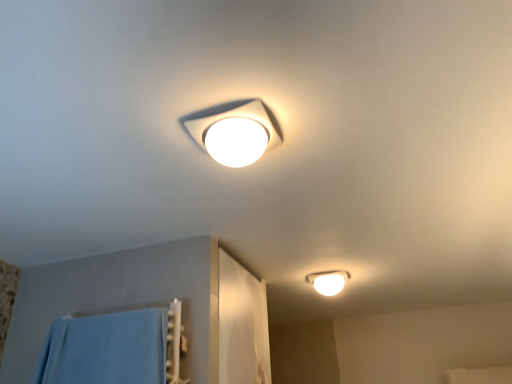
Question: Relative to white glossy light fixture at lower right, which is counted as the first lamp, starting from the right, is white matte lamp at upper center, which appears as the first lamp when viewed from the front, in front or behind?

Choices:
 (A) front
 (B) behind

Answer: (A)

Question: From the image's perspective, is white matte lamp at upper center, which appears as the first lamp when viewed from the front, located above or below white glossy light fixture at lower right, which is counted as the second lamp, starting from the left?

Choices:
 (A) above
 (B) below

Answer: (A)

Question: Looking at the image, does white matte lamp at upper center, which appears as the first lamp when viewed from the front, seem bigger or smaller compared to white glossy light fixture at lower right, which is counted as the second lamp, starting from the left?

Choices:
 (A) small
 (B) big

Answer: (A)

Question: Is white glossy light fixture at lower right, placed as the second lamp when sorted from top to bottom, wider or thinner than white matte lamp at upper center, which appears as the first lamp when viewed from the front?

Choices:
 (A) thin
 (B) wide

Answer: (B)

Question: In terms of size, does white glossy light fixture at lower right, marked as the 1th lamp in a back-to-front arrangement, appear bigger or smaller than white matte lamp at upper center, arranged as the 2th lamp when viewed from the back?

Choices:
 (A) big
 (B) small

Answer: (A)

Question: Is white glossy light fixture at lower right, which ranks as the 1th lamp in bottom-to-top order, in front of or behind white matte lamp at upper center, the 1th lamp when ordered from top to bottom, in the image?

Choices:
 (A) behind
 (B) front

Answer: (A)

Question: Choose the correct answer: Is white glossy light fixture at lower right, which is counted as the second lamp, starting from the left, inside white matte lamp at upper center, which is counted as the 2th lamp, starting from the bottom, or outside it?

Choices:
 (A) inside
 (B) outside

Answer: (B)